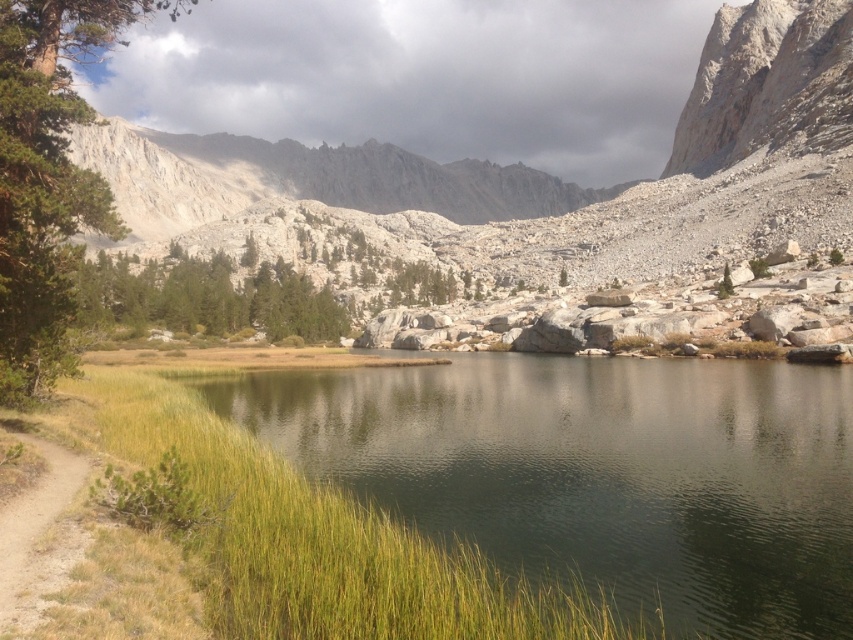
You are a hiker who wants to take a photo of both the green leafy tree at left and the green textured tree at center. Which tree should you stand closer to in order to capture both in the same frame?

You should stand closer to the green textured tree at center because the green leafy tree at left is bigger than the green textured tree at center, so moving closer to the smaller tree will help balance their sizes in the photo.

In the scene shown: You are planning to plant a new tree in this mountain landscape. You have two options based on the existing trees. The green leafy tree at left and the green textured tree at center. Which tree has a wider canopy to provide more shade?

The green leafy tree at left has a wider canopy than the green textured tree at center, so it would provide more shade.

You are standing at the center of the image and want to walk towards the green leafy tree at left. In which direction should you move?

The green leafy tree at left is located at point 0.277 on the x axis and 0.057 on the y axis. Since you are at the center, you should move towards the left and slightly forward to reach the green leafy tree at left.